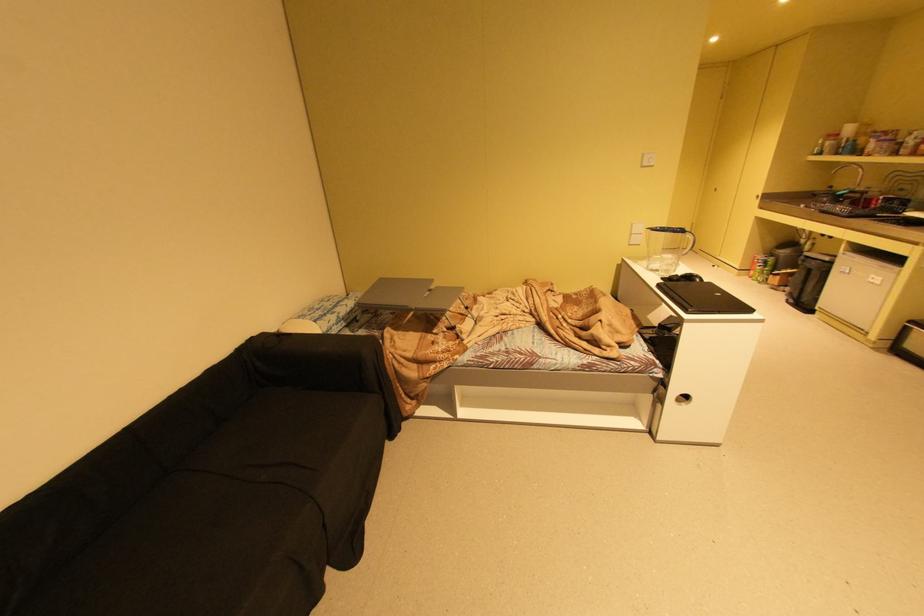
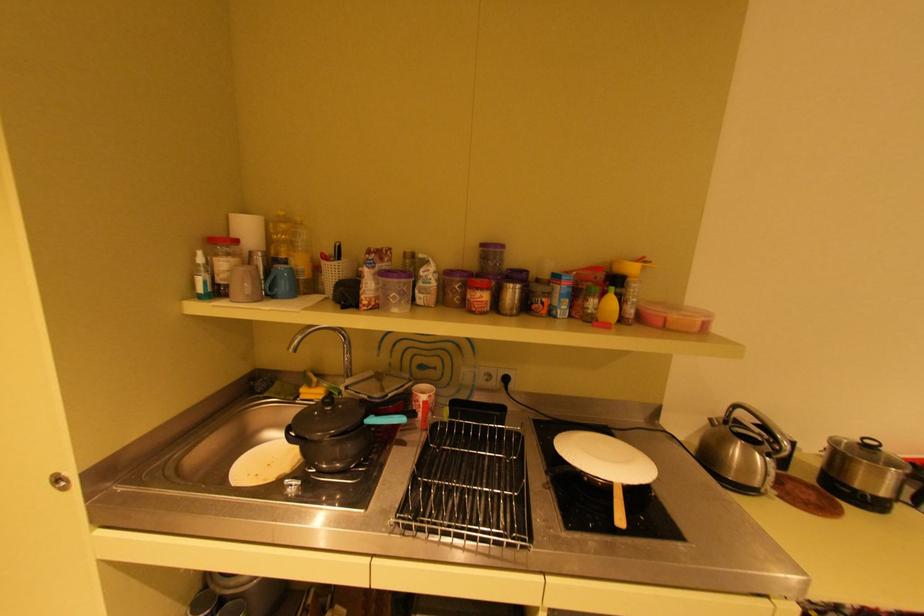
Locate, in the second image, the point that corresponds to point (766, 197) in the first image.

(65, 479)